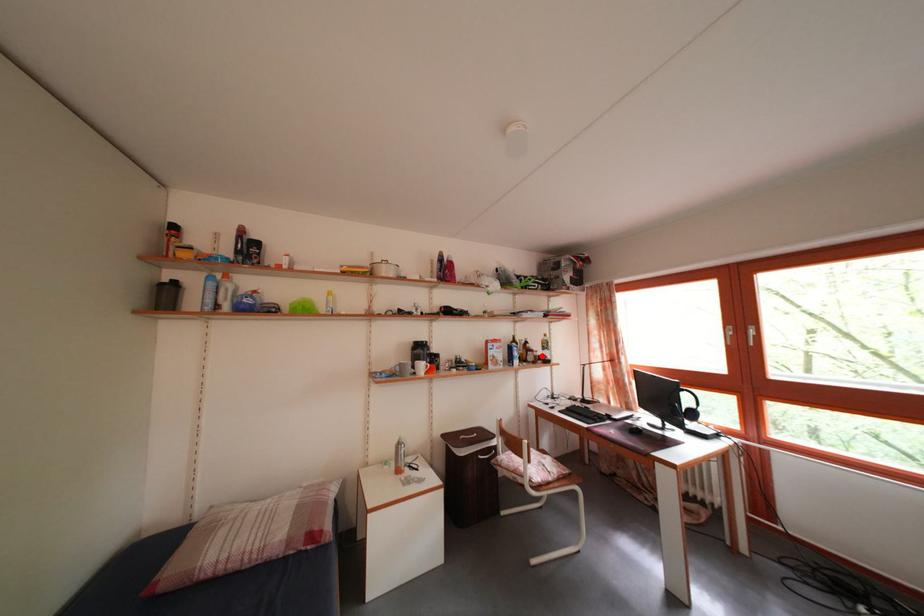
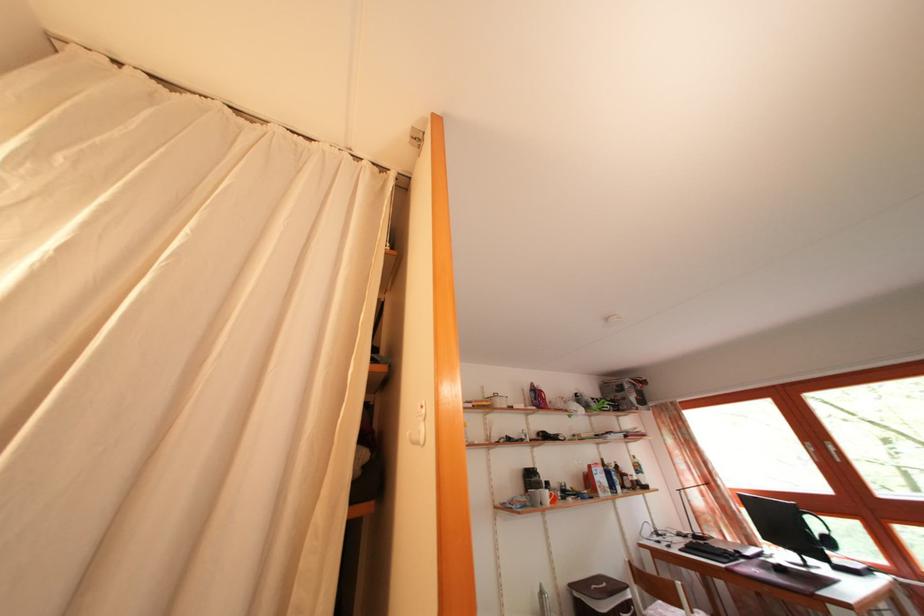
In the second image, find the point that corresponds to the highlighted location in the first image.

(636, 480)